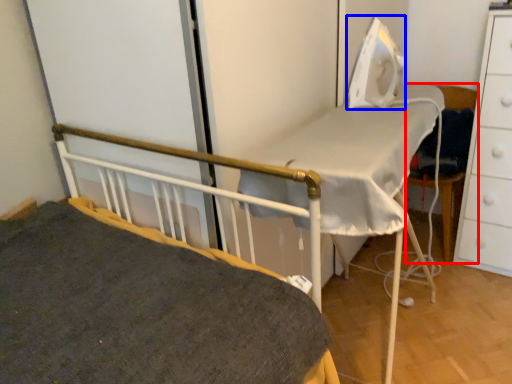
Question: Which object is further to the camera taking this photo, chair (highlighted by a red box) or equipment (highlighted by a blue box)?

Choices:
 (A) chair
 (B) equipment

Answer: (A)